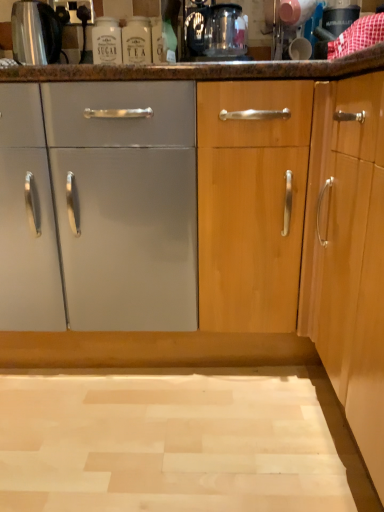
Question: From a real-world perspective, is brushed metal kettle at upper left under transparent glass coffee machine at upper center?

Choices:
 (A) no
 (B) yes

Answer: (A)

Question: Considering the relative sizes of brushed metal kettle at upper left and transparent glass coffee machine at upper center in the image provided, is brushed metal kettle at upper left bigger than transparent glass coffee machine at upper center?

Choices:
 (A) no
 (B) yes

Answer: (A)

Question: Is brushed metal kettle at upper left facing towards transparent glass coffee machine at upper center?

Choices:
 (A) yes
 (B) no

Answer: (B)

Question: Is the depth of brushed metal kettle at upper left less than that of transparent glass coffee machine at upper center?

Choices:
 (A) yes
 (B) no

Answer: (B)

Question: From a real-world perspective, is brushed metal kettle at upper left over transparent glass coffee machine at upper center?

Choices:
 (A) yes
 (B) no

Answer: (A)

Question: Is brushed metal kettle at upper left further to the viewer compared to transparent glass coffee machine at upper center?

Choices:
 (A) yes
 (B) no

Answer: (A)

Question: Is transparent glass coffee machine at upper center completely or partially outside of white glass bottle at upper center?

Choices:
 (A) yes
 (B) no

Answer: (A)

Question: Is transparent glass coffee machine at upper center positioned far away from white glass bottle at upper center?

Choices:
 (A) yes
 (B) no

Answer: (B)

Question: Does transparent glass coffee machine at upper center come in front of white glass bottle at upper center?

Choices:
 (A) yes
 (B) no

Answer: (A)

Question: Is the position of transparent glass coffee machine at upper center more distant than that of white glass bottle at upper center?

Choices:
 (A) yes
 (B) no

Answer: (B)

Question: Is transparent glass coffee machine at upper center smaller than white glass bottle at upper center?

Choices:
 (A) yes
 (B) no

Answer: (B)

Question: Considering the relative sizes of transparent glass coffee machine at upper center and white glass bottle at upper center in the image provided, is transparent glass coffee machine at upper center thinner than white glass bottle at upper center?

Choices:
 (A) yes
 (B) no

Answer: (B)

Question: From a real-world perspective, is brushed metal kettle at upper left beneath white glass bottle at upper center?

Choices:
 (A) no
 (B) yes

Answer: (A)